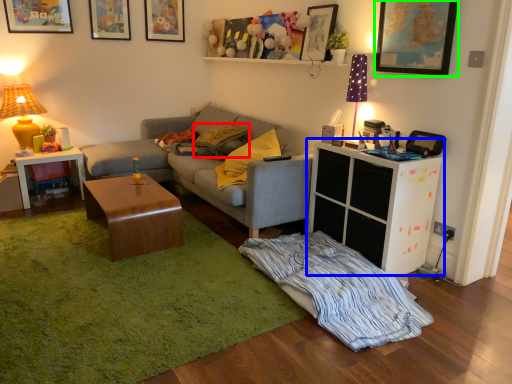
Question: Based on their relative distances, which object is nearer to pillow (highlighted by a red box)? Choose from cabinetry (highlighted by a blue box) and picture frame (highlighted by a green box).

Choices:
 (A) cabinetry
 (B) picture frame

Answer: (A)